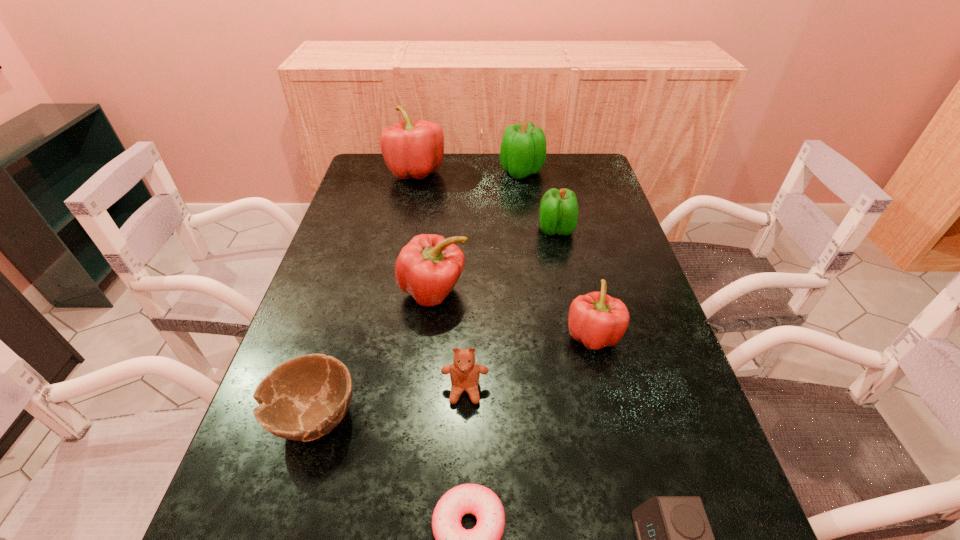
Where is `the fourth closest object to the black alarm clock`? Image resolution: width=960 pixels, height=540 pixels. the fourth closest object to the black alarm clock is located at coordinates (304, 398).

The height and width of the screenshot is (540, 960). Identify the location of object that is the third closest to the smallest pink bell pepper. (558, 214).

Identify which bell pepper is the third nearest to the teddy bear. Please provide its 2D coordinates. Your answer should be formatted as a tuple, i.e. [(x, y)], where the tuple contains the x and y coordinates of a point satisfying the conditions above.

[(558, 214)]

Point out which bell pepper is positioned as the second nearest to the seventh tallest object. Please provide its 2D coordinates. Your answer should be formatted as a tuple, i.e. [(x, y)], where the tuple contains the x and y coordinates of a point satisfying the conditions above.

[(597, 320)]

Identify the location of the third closest pink bell pepper relative to the bigger green bell pepper. The height and width of the screenshot is (540, 960). (597, 320).

Where is `pink bell pepper that is the third nearest to the seventh tallest object`? This screenshot has width=960, height=540. pink bell pepper that is the third nearest to the seventh tallest object is located at coordinates pos(410,149).